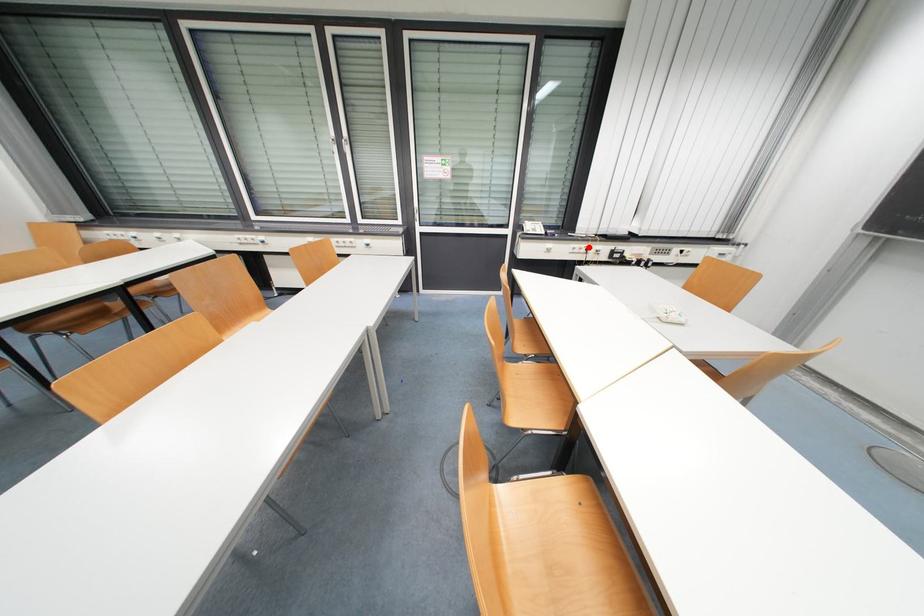
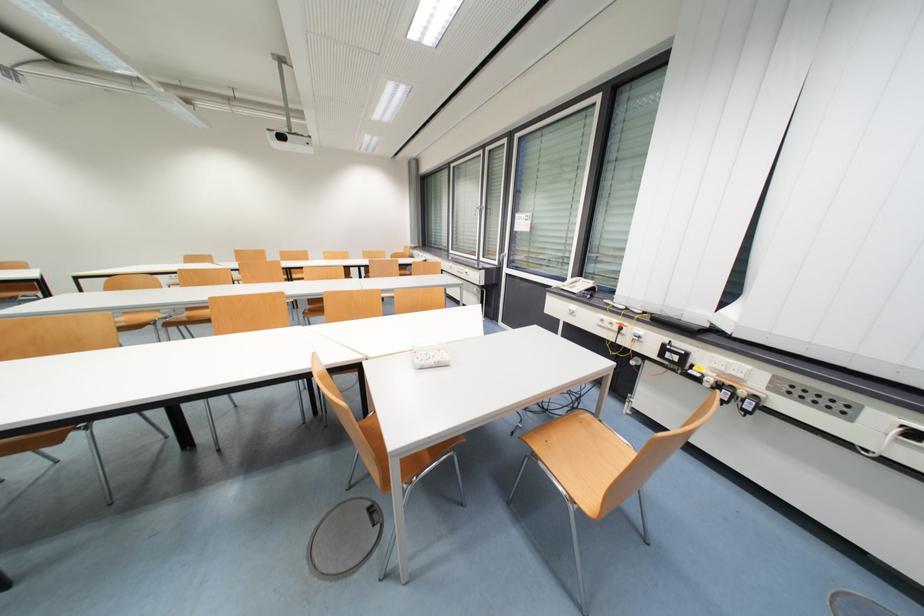
Locate, in the second image, the point that corresponds to the highlighted location in the first image.

(622, 323)